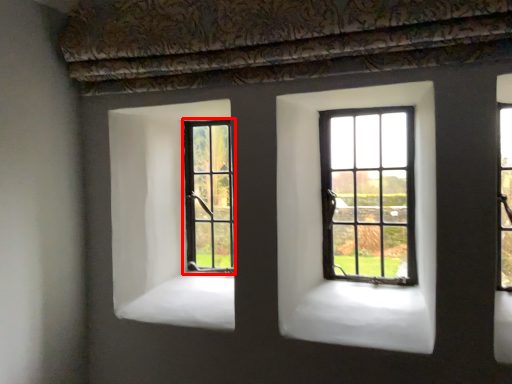
Question: From the image, what is the correct spatial relationship of window (annotated by the red box) in relation to window?

Choices:
 (A) left
 (B) right

Answer: (A)